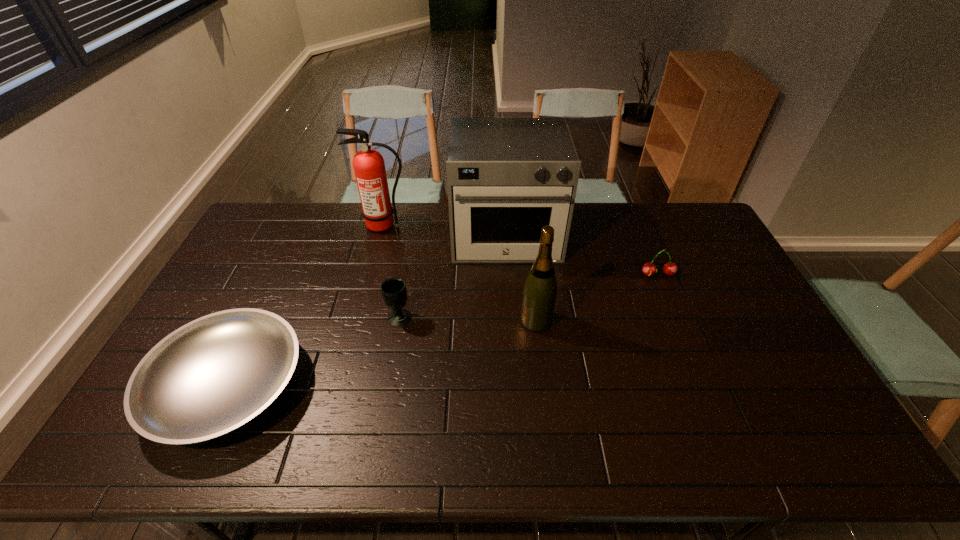
Identify the location of unoccupied position between the fire extinguisher and the toaster oven. (444, 231).

Identify the location of vacant space in between the bedpan and the toaster oven. (367, 310).

Where is `vacant area between the shortest object and the second shortest object`? This screenshot has width=960, height=540. vacant area between the shortest object and the second shortest object is located at coordinates (443, 330).

Find the location of a particular element. Image resolution: width=960 pixels, height=540 pixels. blank region between the fourth tallest object and the leftmost object is located at coordinates (314, 351).

Identify which object is the third closest to the wine bottle. Please provide its 2D coordinates. Your answer should be formatted as a tuple, i.e. [(x, y)], where the tuple contains the x and y coordinates of a point satisfying the conditions above.

[(670, 268)]

Where is `object that is the fifth closest to the chalice`? object that is the fifth closest to the chalice is located at coordinates (670, 268).

Image resolution: width=960 pixels, height=540 pixels. Find the location of `free space that satisfies the following two spatial constraints: 1. on the handle side of the chalice; 2. on the right side of the fire extinguisher`. free space that satisfies the following two spatial constraints: 1. on the handle side of the chalice; 2. on the right side of the fire extinguisher is located at coordinates (360, 317).

This screenshot has width=960, height=540. I want to click on vacant space that satisfies the following two spatial constraints: 1. with stems pointing upwards on the rightmost object; 2. on the front-facing side of the wine bottle, so click(x=677, y=320).